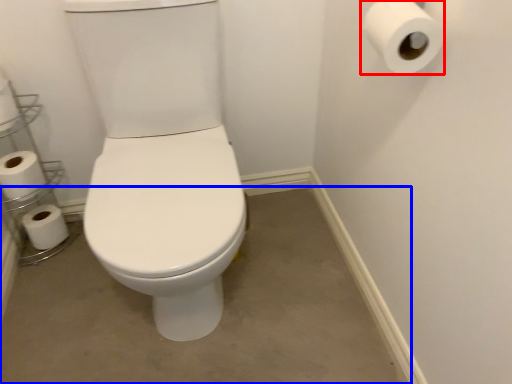
Question: Which of the following is the farthest to the observer, toilet paper (highlighted by a red box) or concrete (highlighted by a blue box)?

Choices:
 (A) toilet paper
 (B) concrete

Answer: (B)